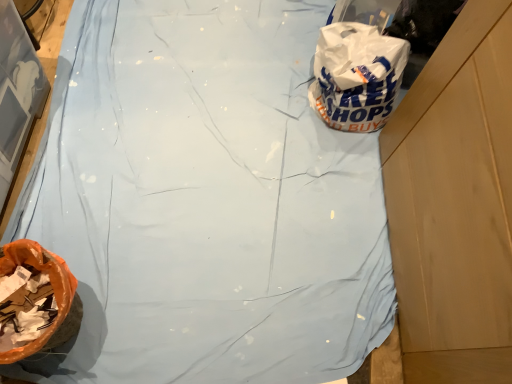
Question: From their relative heights in the image, would you say orange plastic bag at lower left is taller or shorter than white plastic bag at upper right?

Choices:
 (A) tall
 (B) short

Answer: (A)

Question: From a real-world perspective, is orange plastic bag at lower left physically located above or below white plastic bag at upper right?

Choices:
 (A) below
 (B) above

Answer: (B)

Question: Is orange plastic bag at lower left inside or outside of white plastic bag at upper right?

Choices:
 (A) inside
 (B) outside

Answer: (B)

Question: Relative to orange plastic bag at lower left, is white plastic bag at upper right in front or behind?

Choices:
 (A) behind
 (B) front

Answer: (A)

Question: From the image's perspective, is white plastic bag at upper right located above or below orange plastic bag at lower left?

Choices:
 (A) above
 (B) below

Answer: (A)

Question: From a real-world perspective, relative to orange plastic bag at lower left, is white plastic bag at upper right vertically above or below?

Choices:
 (A) above
 (B) below

Answer: (B)

Question: In terms of height, does white plastic bag at upper right look taller or shorter compared to orange plastic bag at lower left?

Choices:
 (A) tall
 (B) short

Answer: (B)